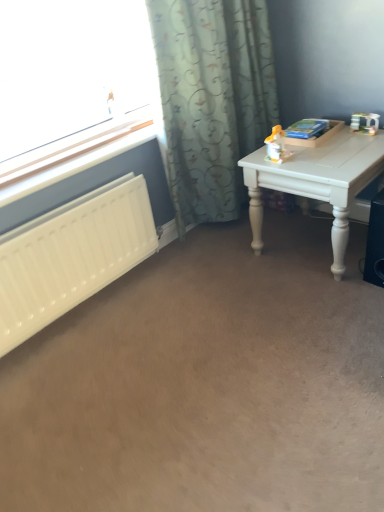
Locate an element on the screen. This screenshot has height=512, width=384. unoccupied area in front of white painted wood table at right is located at coordinates (316, 310).